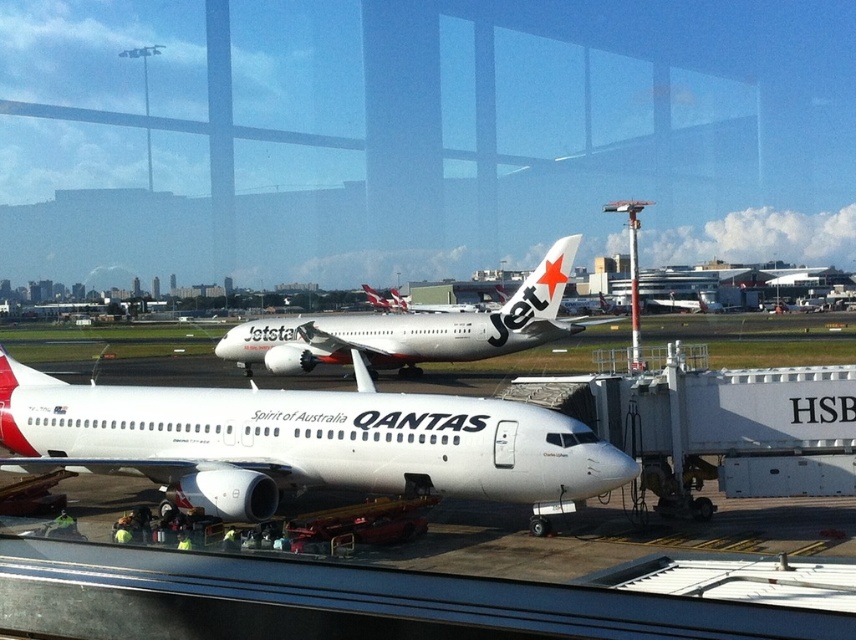
Who is shorter, white glossy airliner at center or white glossy airplane at center?

white glossy airliner at center

Is white glossy airliner at center bigger than white glossy airplane at center?

Incorrect, white glossy airliner at center is not larger than white glossy airplane at center.

Image resolution: width=856 pixels, height=640 pixels. Describe the element at coordinates (301, 442) in the screenshot. I see `white glossy airliner at center` at that location.

Locate an element on the screen. The image size is (856, 640). white glossy airliner at center is located at coordinates (301, 442).